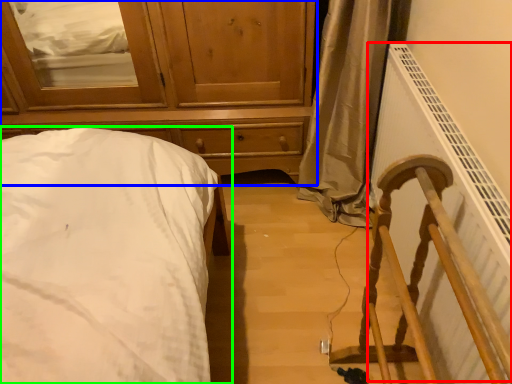
Question: Which is nearer to the radiator (highlighted by a red box)? chest of drawers (highlighted by a blue box) or bed (highlighted by a green box).

Choices:
 (A) chest of drawers
 (B) bed

Answer: (A)